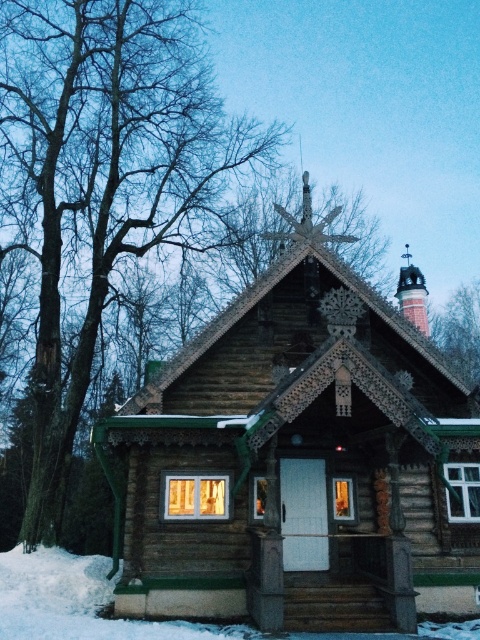
Is brown wood tree at upper left below white fluffy snow at bottom?

No, brown wood tree at upper left is not below white fluffy snow at bottom.

Between point (56, 227) and point (95, 586), which one is positioned behind?

Point (56, 227)

Measure the distance between point (1, 58) and camera.

22.17 meters

Identify the location of brown wood tree at upper left. (104, 186).

Does wooden cabin at center come behind brown wood tree at upper left?

No, wooden cabin at center is in front of brown wood tree at upper left.

Is wooden cabin at center wider than brown wood tree at upper left?

Incorrect, wooden cabin at center's width does not surpass brown wood tree at upper left's.

Where is `wooden cabin at center`? wooden cabin at center is located at coordinates (300, 460).

Locate an element on the screen. wooden cabin at center is located at coordinates (300, 460).

From the picture: Can you confirm if wooden cabin at center is positioned to the right of white fluffy snow at bottom?

Correct, you'll find wooden cabin at center to the right of white fluffy snow at bottom.

Which is below, wooden cabin at center or white fluffy snow at bottom?

Positioned lower is white fluffy snow at bottom.

Is point (299, 611) positioned behind point (157, 636)?

Yes.

Locate an element on the screen. wooden cabin at center is located at coordinates (300, 460).